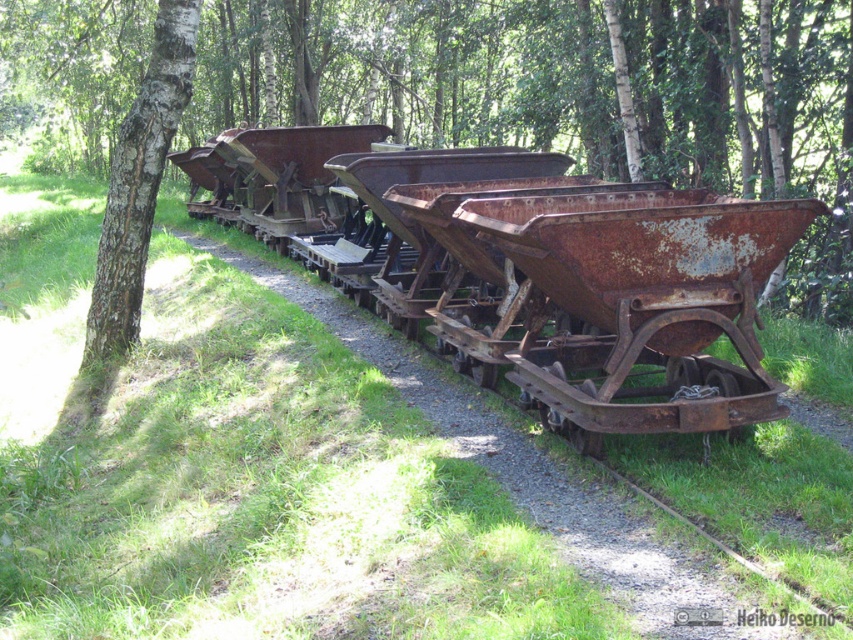
Between point (340, 138) and point (173, 16), which one is positioned in front?

Positioned in front is point (173, 16).

Who is taller, rusty metal wagon at center or white bark tree at left?

rusty metal wagon at center is taller.

Identify the location of rusty metal wagon at center. Image resolution: width=853 pixels, height=640 pixels. (576, 275).

Image resolution: width=853 pixels, height=640 pixels. I want to click on rusty metal wagon at center, so click(576, 275).